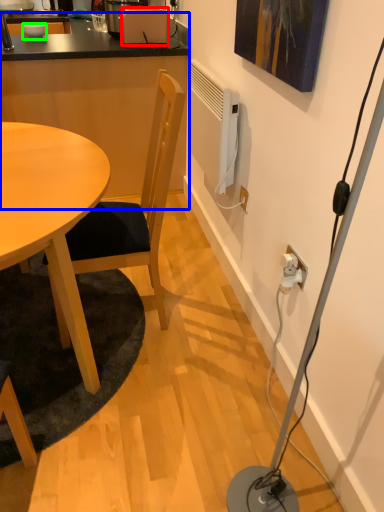
Question: Which is farther away from toaster (highlighted by a red box)? computer desk (highlighted by a blue box) or bowl (highlighted by a green box)?

Choices:
 (A) computer desk
 (B) bowl

Answer: (B)